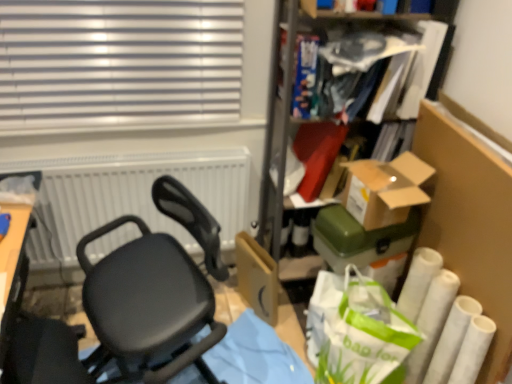
Question: From the image's perspective, is cardboard box at center located above or below green paper shopping bag at lower right?

Choices:
 (A) below
 (B) above

Answer: (B)

Question: Considering the positions of point (266, 301) and point (369, 319), is point (266, 301) closer or farther from the camera than point (369, 319)?

Choices:
 (A) closer
 (B) farther

Answer: (B)

Question: Which object is the farthest from the white matte radiator at upper left?

Choices:
 (A) green paper shopping bag at lower right
 (B) black matte chair at center
 (C) brown cardboard box at upper right, which is counted as the first box, starting from the top
 (D) cardboard box at center
 (E) matte black book at upper right, the first book from the right

Answer: (C)

Question: Which of these objects is positioned closest to the green matte box at center-right, the first box when ordered from bottom to top?

Choices:
 (A) white matte radiator at upper left
 (B) cardboard box at center
 (C) green paper shopping bag at lower right
 (D) brown cardboard box at upper right, which ranks as the 2th box in bottom-to-top order
 (E) black matte chair at center

Answer: (D)